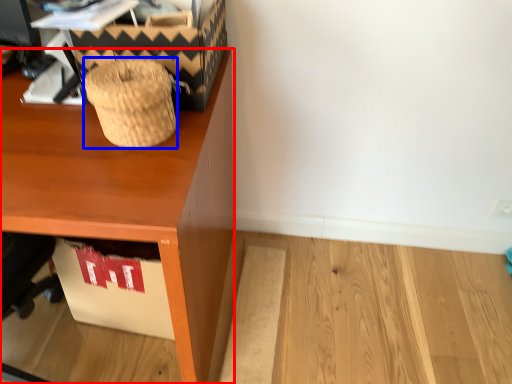
Question: Which object appears closest to the camera in this image, desk (highlighted by a red box) or basket (highlighted by a blue box)?

Choices:
 (A) desk
 (B) basket

Answer: (A)